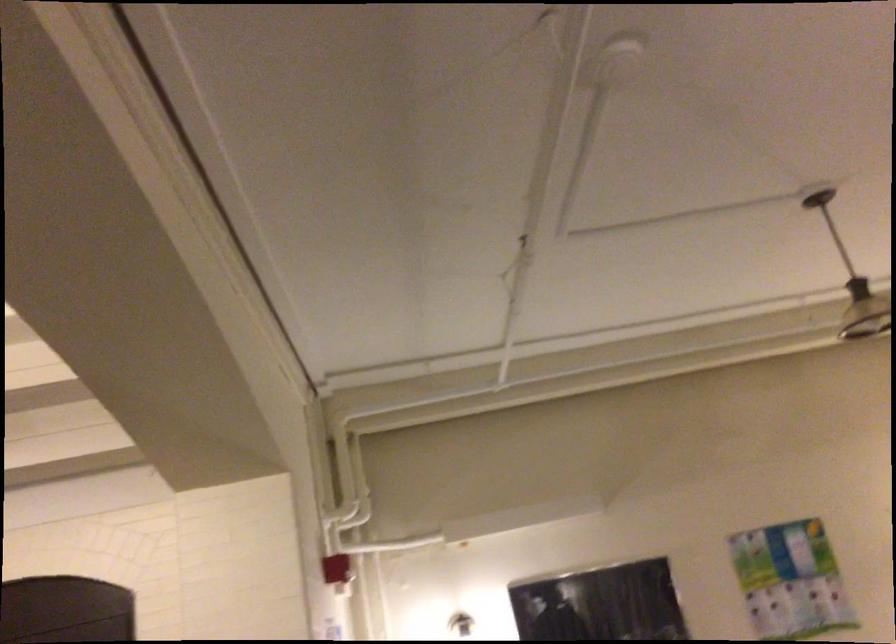
The width and height of the screenshot is (896, 644). I want to click on red fire alarm lever, so click(337, 569).